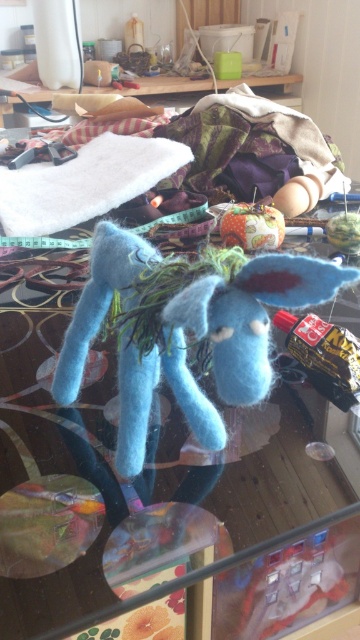
Question: Can you confirm if fuzzy blue stuffed animal at center is thinner than white fluffy cloth at upper left?

Choices:
 (A) no
 (B) yes

Answer: (B)

Question: Which point appears farthest from the camera in this image?

Choices:
 (A) pyautogui.click(x=114, y=176)
 (B) pyautogui.click(x=232, y=305)
 (C) pyautogui.click(x=6, y=112)

Answer: (C)

Question: Based on their relative distances, which object is farther from the fuzzy blue stuffed animal at center?

Choices:
 (A) wooden table at upper center
 (B) white fluffy cloth at upper left

Answer: (A)

Question: Where is fuzzy blue stuffed animal at center located in relation to wooden table at upper center in the image?

Choices:
 (A) above
 (B) below

Answer: (B)

Question: Among these objects, which one is farthest from the camera?

Choices:
 (A) fuzzy blue stuffed animal at center
 (B) wooden table at upper center
 (C) white fluffy cloth at upper left

Answer: (B)

Question: Can you confirm if fuzzy blue stuffed animal at center is wider than wooden table at upper center?

Choices:
 (A) no
 (B) yes

Answer: (A)